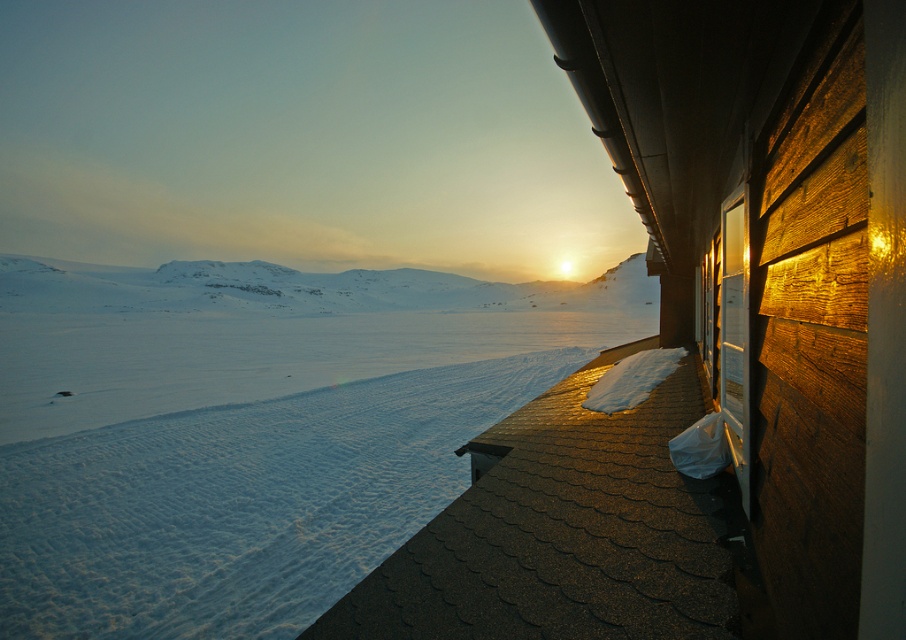
Who is more forward, (126,285) or (219,292)?

Point (219,292) is in front.

The height and width of the screenshot is (640, 906). In order to click on snowy white snow at center in this screenshot , I will do `click(252, 429)`.